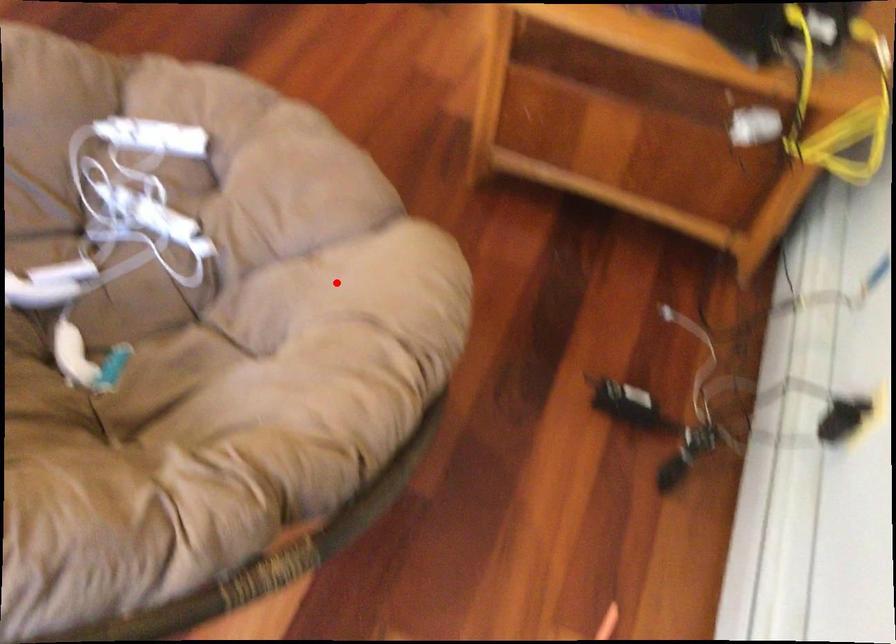
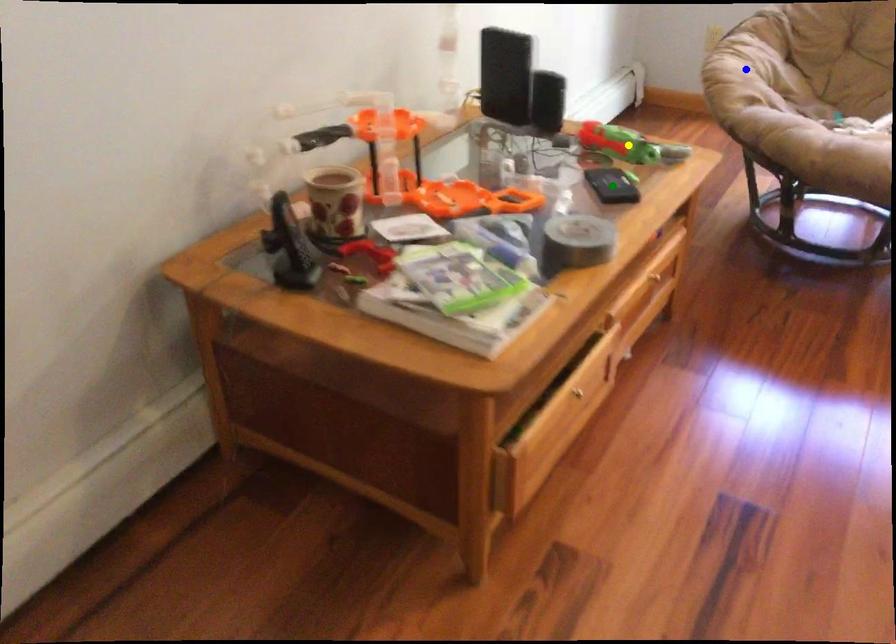
Question: I am providing you with two images of the same scene from different viewpoints. A red point is marked on the first image. You are given multiple points on the second image. Which point in image 2 represents the same 3d spot as the red point in image 1?

Choices:
 (A) blue point
 (B) yellow point
 (C) green point

Answer: (A)